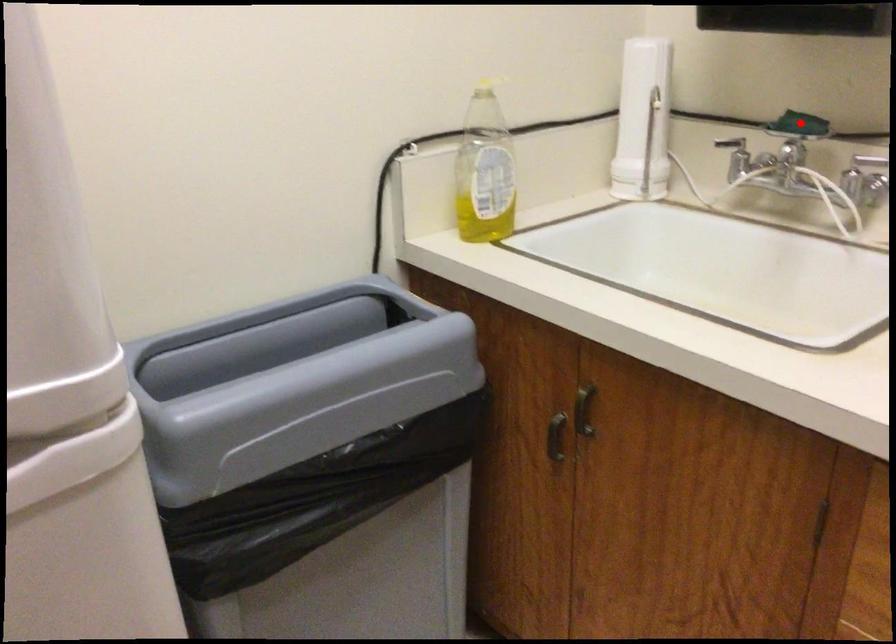
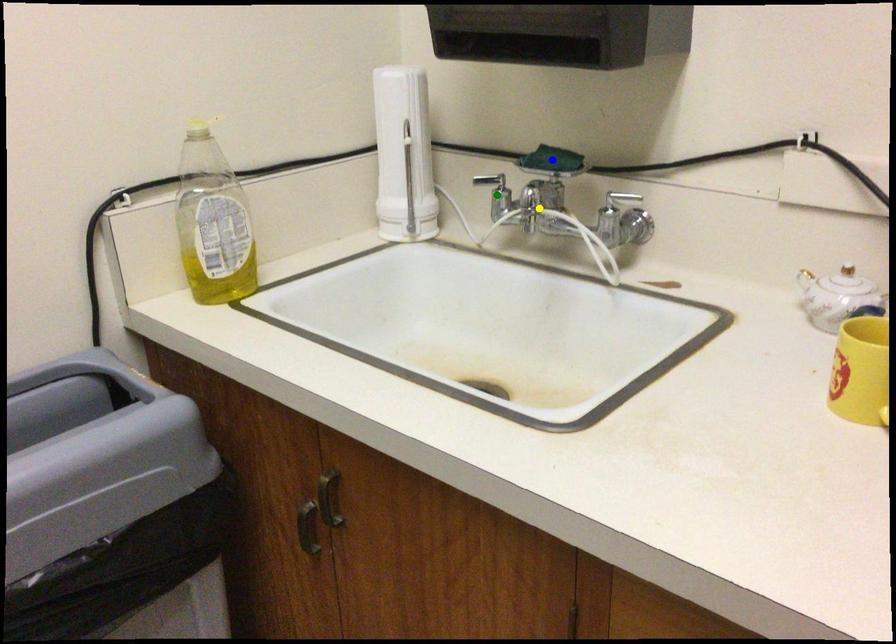
Question: I am providing you with two images of the same scene from different viewpoints. A red point is marked on the first image. You are given multiple points on the second image. Which mark in image 2 goes with the point in image 1?

Choices:
 (A) green point
 (B) blue point
 (C) yellow point

Answer: (B)